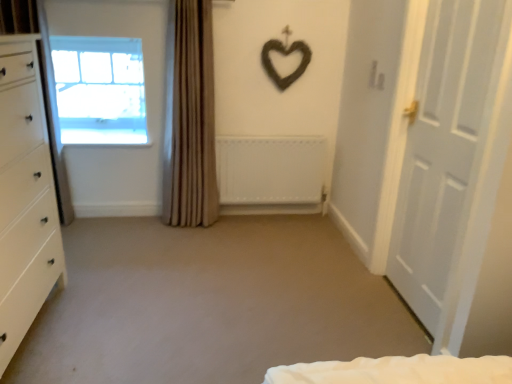
I want to click on free area below white matte radiator at center (from a real-world perspective), so click(x=268, y=211).